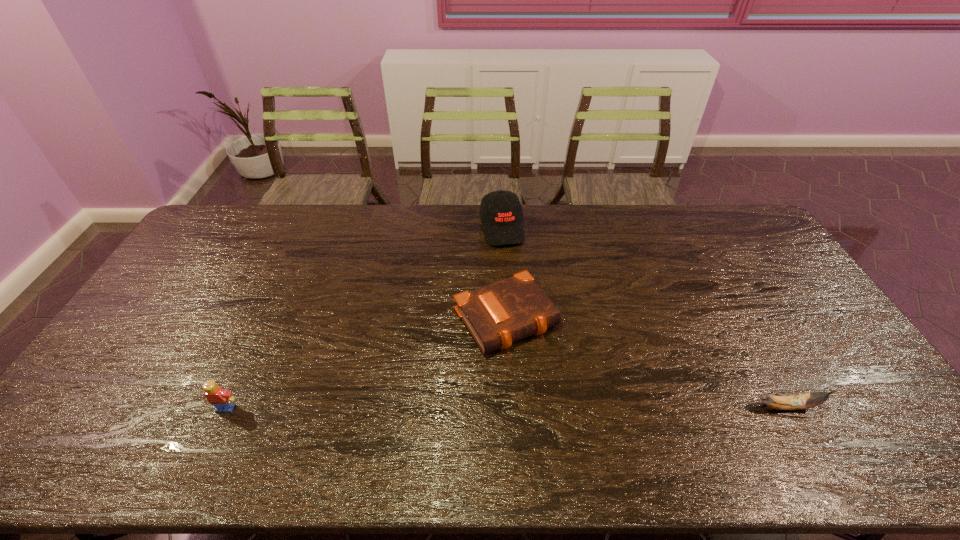
Locate an element on the screen. The width and height of the screenshot is (960, 540). vacant area that lies between the third nearest object and the second shortest object is located at coordinates (647, 363).

The image size is (960, 540). I want to click on unoccupied area between the Lego and the farthest object, so click(x=364, y=318).

What are the coordinates of `empty space between the shortest object and the leftmost object` in the screenshot? It's located at (367, 363).

This screenshot has height=540, width=960. What are the coordinates of `blank region between the baseball cap and the rightmost object` in the screenshot? It's located at (644, 317).

You are a GUI agent. You are given a task and a screenshot of the screen. Output one action in this format:
    pyautogui.click(x=<x>, y=<y>)
    Task: Click on the free space between the banana and the farthest object
    Image resolution: width=960 pixels, height=540 pixels.
    Given the screenshot: What is the action you would take?
    tap(644, 317)

You are a GUI agent. You are given a task and a screenshot of the screen. Output one action in this format:
    pyautogui.click(x=<x>, y=<y>)
    Task: Click on the vacant space that is in between the rightmost object and the baseball cap
    Image resolution: width=960 pixels, height=540 pixels.
    Given the screenshot: What is the action you would take?
    click(644, 317)

What are the coordinates of `vacant space that's between the farthest object and the leftmost object` in the screenshot? It's located at (364, 318).

You are a GUI agent. You are given a task and a screenshot of the screen. Output one action in this format:
    pyautogui.click(x=<x>, y=<y>)
    Task: Click on the empty space between the Bible and the Lego
    
    Given the screenshot: What is the action you would take?
    pyautogui.click(x=367, y=363)

Where is `free space that is in between the third nearest object and the banana`? The image size is (960, 540). free space that is in between the third nearest object and the banana is located at coordinates (647, 363).

Identify the location of empty space between the farthest object and the leftmost object. Image resolution: width=960 pixels, height=540 pixels. (364, 318).